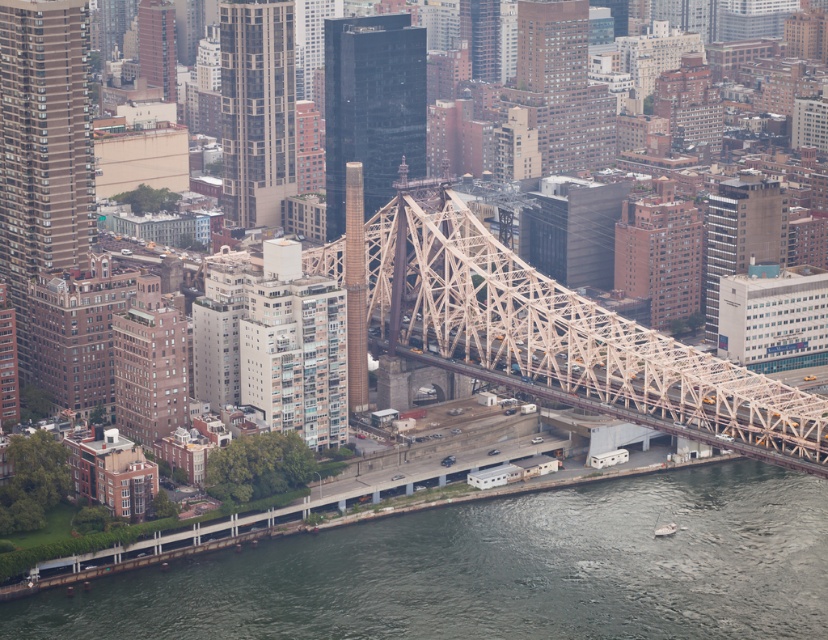
You are standing on a balcony overlooking the city and see two points in the scene. The first point is located at coordinates point (422, 547) and the second point is at point (535, 348). Which point appears closer to you from your vantage point on the balcony?

Point (422, 547) is further to the camera than point (535, 348), so the second point at point (535, 348) appears closer to you.

You are standing at a viewpoint overlooking the city and want to know the distance to a specific point marked as point (610, 552). Can you determine how far this point is from your current position?

The point (610, 552) is 658.38 meters away from the viewer, so the distance is 658.38 meters.